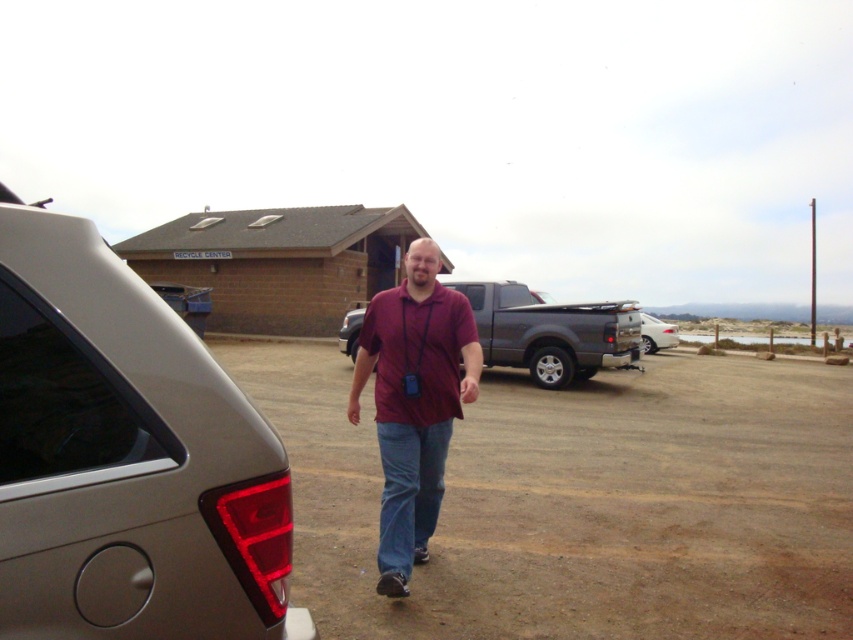
Question: Is satin metallic car at left wider than denim at center?

Choices:
 (A) yes
 (B) no

Answer: (A)

Question: Which point is closer to the camera?

Choices:
 (A) denim at center
 (B) matte black suv at center
 (C) maroon fabric shirt at center

Answer: (C)

Question: Which point is closer to the camera?

Choices:
 (A) maroon fabric shirt at center
 (B) matte black suv at center
 (C) denim at center

Answer: (A)

Question: Which point is farther to the camera?

Choices:
 (A) denim at center
 (B) satin metallic car at left
 (C) matte black suv at center

Answer: (C)

Question: Is satin metallic car at left above white glossy car at center?

Choices:
 (A) yes
 (B) no

Answer: (A)

Question: Is maroon fabric shirt at center further to camera compared to white glossy car at center?

Choices:
 (A) yes
 (B) no

Answer: (B)